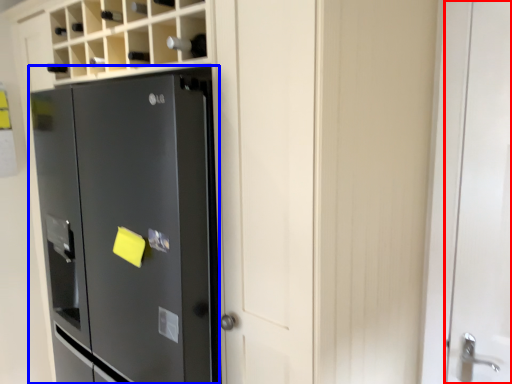
Question: Which of the following is the farthest to the observer, door (highlighted by a red box) or refrigerator (highlighted by a blue box)?

Choices:
 (A) door
 (B) refrigerator

Answer: (A)